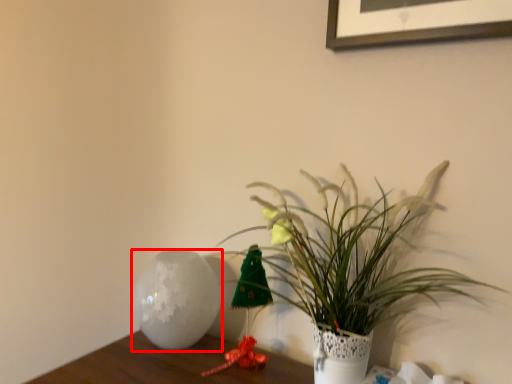
Question: Where is vase (annotated by the red box) located in relation to houseplant in the image?

Choices:
 (A) right
 (B) left

Answer: (B)